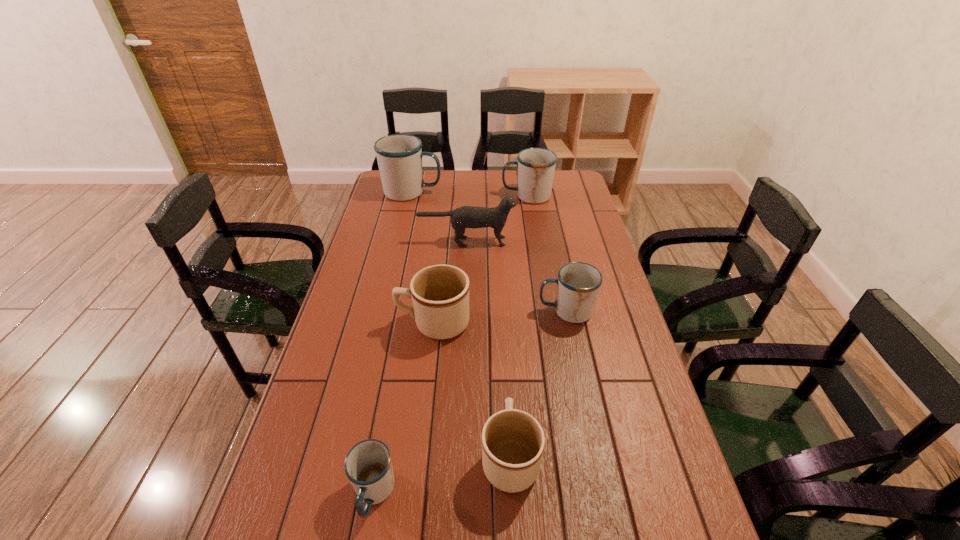
I want to click on the biggest white mug, so click(x=399, y=156).

You are a GUI agent. You are given a task and a screenshot of the screen. Output one action in this format:
    pyautogui.click(x=<x>, y=<y>)
    Task: Click on the cat
    This screenshot has height=540, width=960.
    Given the screenshot: What is the action you would take?
    pyautogui.click(x=463, y=217)

Find the location of `black cat`. black cat is located at coordinates (463, 217).

Where is `the third smallest white mug`? the third smallest white mug is located at coordinates (536, 166).

The width and height of the screenshot is (960, 540). I want to click on the farther brown mug, so [440, 293].

Find the location of a particular element. This screenshot has height=540, width=960. the bigger brown mug is located at coordinates (440, 293).

At what (x,y) coordinates should I click in order to perform the action: click on the third biggest white mug. Please return your answer as a coordinate pair (x, y). Looking at the image, I should click on (578, 283).

The width and height of the screenshot is (960, 540). Find the location of `the right brown mug`. the right brown mug is located at coordinates (513, 441).

I want to click on the smaller brown mug, so click(x=513, y=441).

Find the location of a particular element. Image resolution: width=960 pixels, height=540 pixels. the shortest mug is located at coordinates (368, 466).